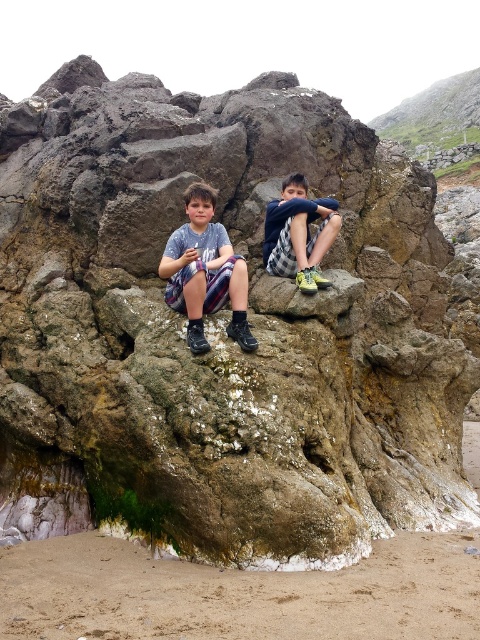
Question: Where is matte blue shirt at center located in relation to checkered fabric shorts at center in the image?

Choices:
 (A) left
 (B) right

Answer: (A)

Question: Is the position of matte blue shirt at center less distant than that of checkered fabric shorts at center?

Choices:
 (A) no
 (B) yes

Answer: (B)

Question: From the image, what is the correct spatial relationship of matte blue shirt at center in relation to checkered fabric shorts at center?

Choices:
 (A) above
 (B) below

Answer: (B)

Question: Which of the following is the closest to the observer?

Choices:
 (A) (305, 253)
 (B) (203, 342)

Answer: (B)

Question: Which of the following is the closest to the observer?

Choices:
 (A) matte blue shirt at center
 (B) checkered fabric shorts at center

Answer: (A)

Question: Which of the following is the closest to the observer?

Choices:
 (A) matte blue shirt at center
 (B) checkered fabric shorts at center

Answer: (A)